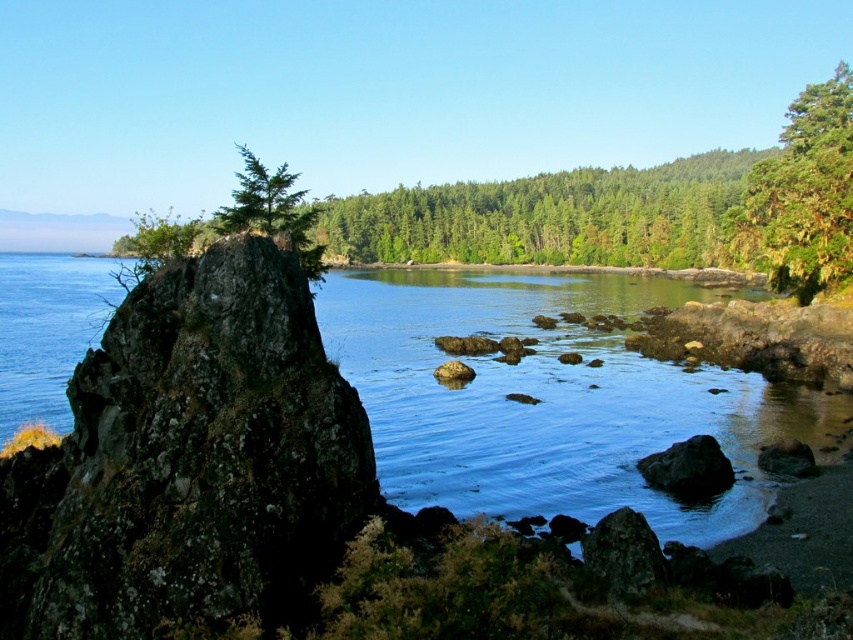
You are standing at the edge of the coastal landscape and want to reach the point marked at coordinates (590, 416). How far will you have to walk to get there?

The point marked at coordinates (590, 416) is 30.09 meters away from the viewer, so you will have to walk 30.09 meters to reach it.